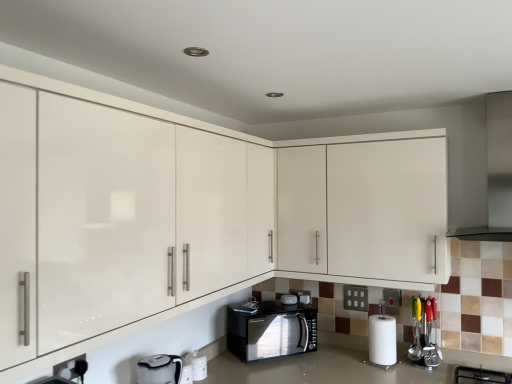
Question: Is point (374, 316) positioned closer to the camera than point (284, 299)?

Choices:
 (A) farther
 (B) closer

Answer: (B)

Question: In terms of height, does white matte paper towel at lower right look taller or shorter compared to black glossy microwave at lower center, the second appliance positioned from the back?

Choices:
 (A) tall
 (B) short

Answer: (A)

Question: Which of these objects is positioned farthest from the black glossy microwave at lower center, the second appliance positioned from the back?

Choices:
 (A) black matte gas stove at lower right
 (B) white matte paper towel at lower right
 (C) satin silver exhaust hood at upper right
 (D) white glossy container at lower center, marked as the 4th appliance in a back-to-front arrangement
 (E) black glossy microwave at center, positioned as the 2th appliance in right-to-left order

Answer: (C)

Question: Which is nearer to the white glossy cabinet at upper center, which is the first cabinetry in back-to-front order?

Choices:
 (A) black glossy microwave at lower center, the 3th appliance from the front
 (B) matte white cabinets at center, marked as the 2th cabinetry in a back-to-front arrangement
 (C) black glossy microwave at center
 (D) black matte gas stove at lower right
 (E) white glossy container at lower center, marked as the 4th appliance in a back-to-front arrangement

Answer: (C)